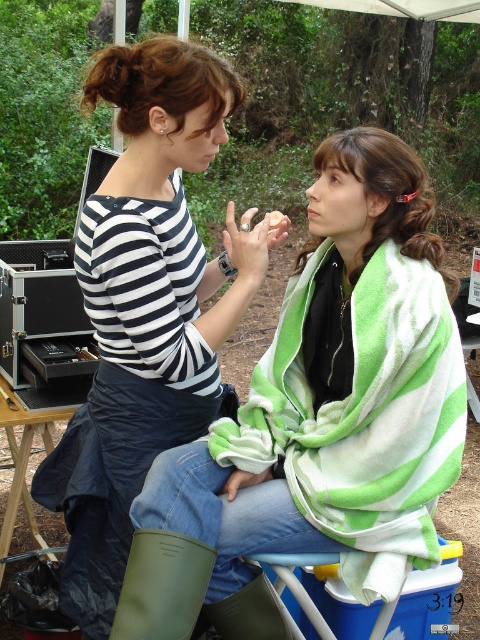
Question: Which of the following is the farthest from the observer?

Choices:
 (A) (164, 435)
 (B) (395, 168)

Answer: (A)

Question: Which object is farther from the camera taking this photo?

Choices:
 (A) striped fabric shirt at center
 (B) green striped towel at center

Answer: (A)

Question: Is green striped towel at center closer to the viewer compared to green rubber boot at lower left?

Choices:
 (A) no
 (B) yes

Answer: (A)

Question: Among these points, which one is nearest to the camera?

Choices:
 (A) (127, 166)
 (B) (205, 589)
 (C) (409, 168)

Answer: (B)

Question: Can you confirm if green striped towel at center is wider than striped fabric shirt at center?

Choices:
 (A) no
 (B) yes

Answer: (B)

Question: Observing the image, what is the correct spatial positioning of green striped towel at center in reference to green rubber boot at lower left?

Choices:
 (A) right
 (B) left

Answer: (A)